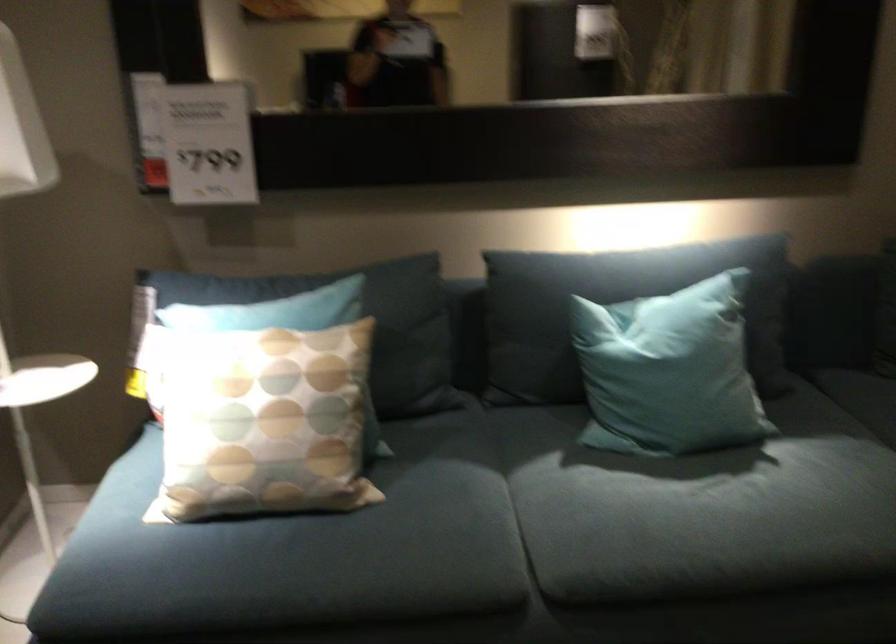
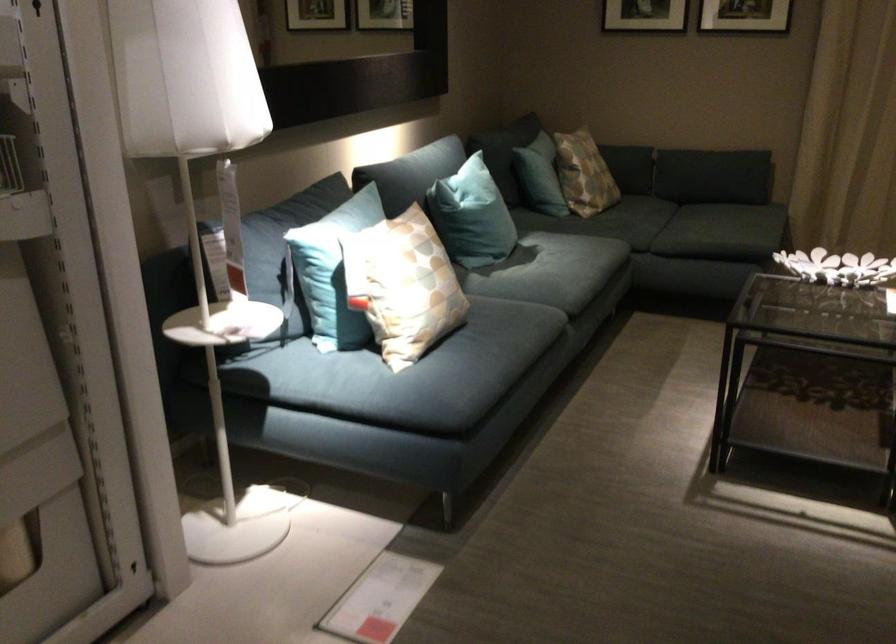
In the second image, find the point that corresponds to pixel 211 415 in the first image.

(402, 285)